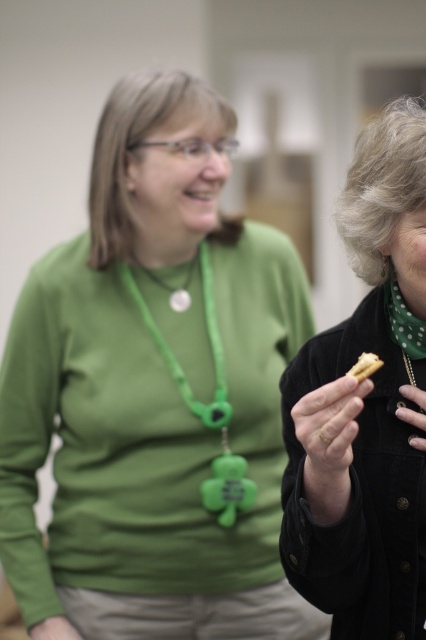
Is brown matte cookie at center behind yellow matte cookie at center right?

No, it is in front of yellow matte cookie at center right.

Does point (345, 417) come behind point (373, 368)?

No, (345, 417) is in front of (373, 368).

In order to click on brown matte cookie at center in this screenshot , I will do `click(328, 432)`.

Does velvet black jacket at right come in front of brown matte cookie at center?

Yes, it is in front of brown matte cookie at center.

Is velvet black jacket at right positioned behind brown matte cookie at center?

No, it is not.

Does point (380, 369) come closer to viewer compared to point (304, 474)?

No, (380, 369) is behind (304, 474).

At what (x,y) coordinates should I click in order to perform the action: click on velvet black jacket at right. Please return your answer as a coordinate pair (x, y). This screenshot has width=426, height=640. Looking at the image, I should click on (365, 406).

Consider the image. Can you confirm if green matte necklace at center is positioned above brown matte cookie at center?

Correct, green matte necklace at center is located above brown matte cookie at center.

Find the location of a particular element. green matte necklace at center is located at coordinates (154, 392).

Find the location of a particular element. green matte necklace at center is located at coordinates (154, 392).